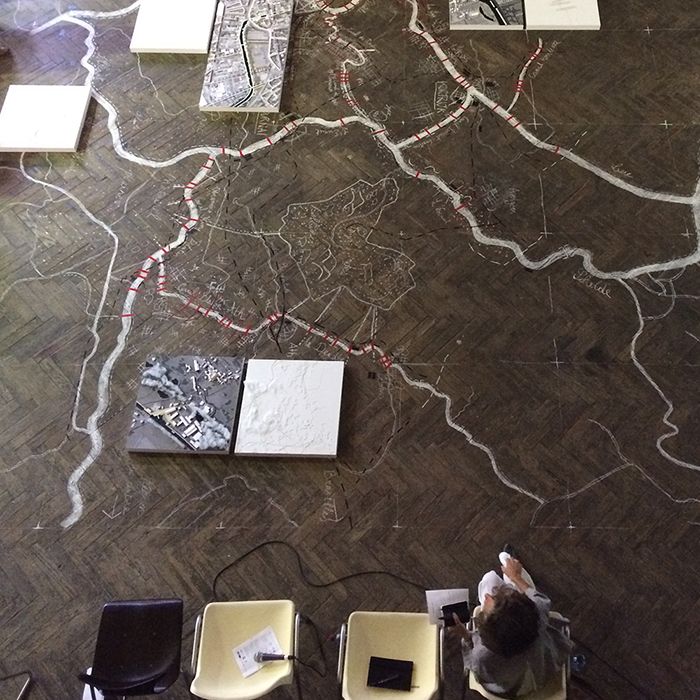
Image resolution: width=700 pixels, height=700 pixels. Find the location of `unoccupied chair`. unoccupied chair is located at coordinates (382, 637), (236, 609), (150, 620).